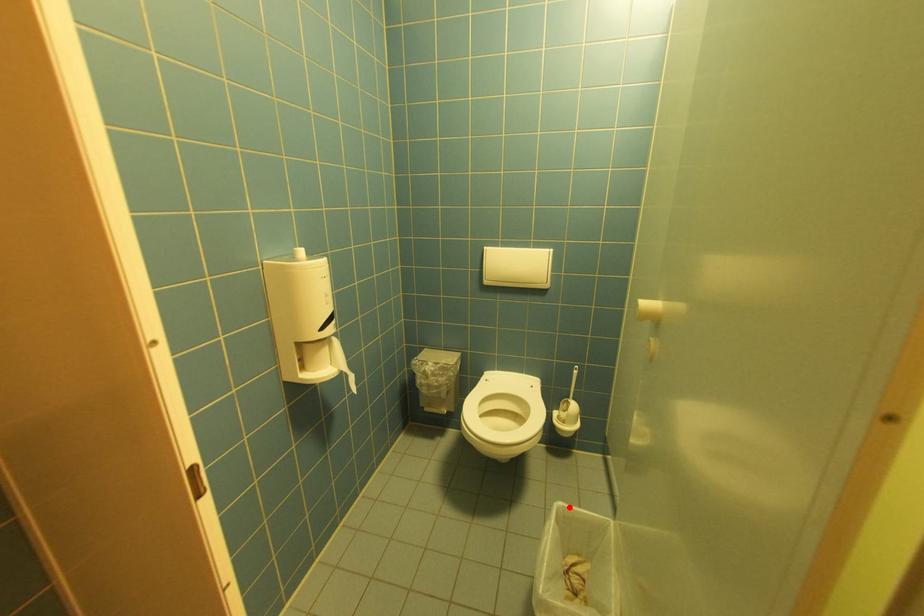
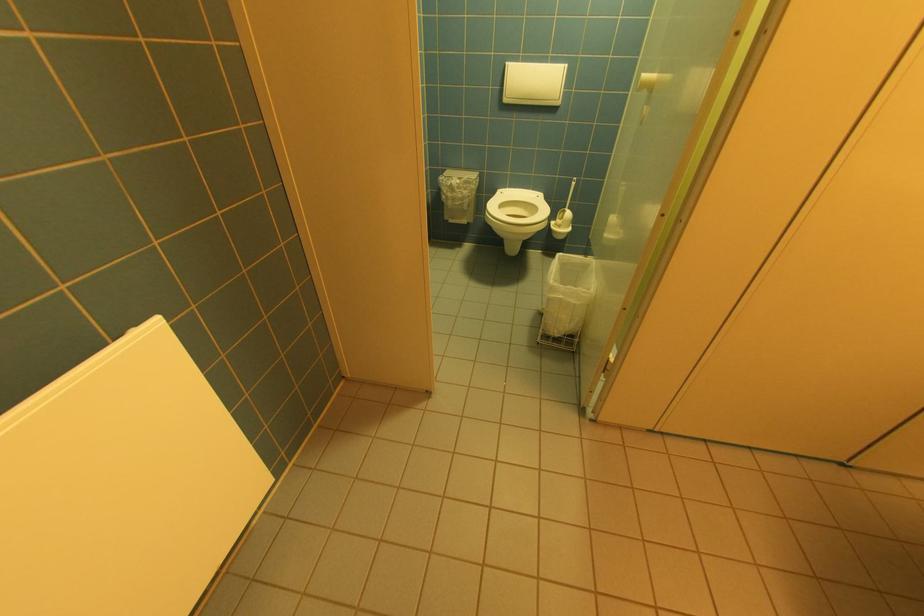
Locate, in the second image, the point that corresponds to the highlighted location in the first image.

(568, 256)